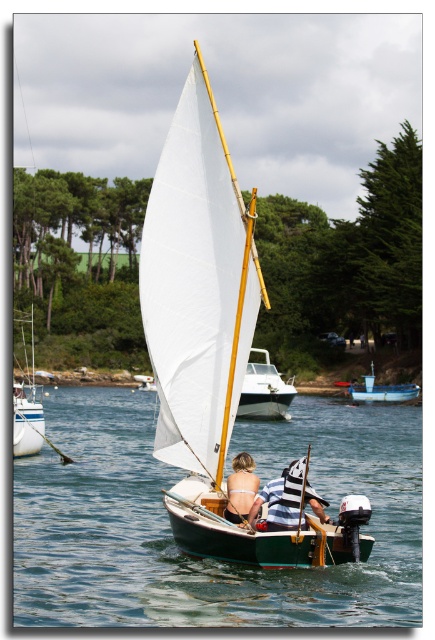
Is white plastic boat at left positioned behind blue plastic boat at center?

No, white plastic boat at left is in front of blue plastic boat at center.

Is white plastic boat at left closer to the viewer compared to blue plastic boat at center?

Yes, white plastic boat at left is closer to the viewer.

The width and height of the screenshot is (435, 640). I want to click on white plastic boat at left, so click(x=26, y=401).

Which is above, clear blue water at center or white glossy sailboat at center?

white glossy sailboat at center is above.

Between clear blue water at center and white glossy sailboat at center, which one has more height?

With more height is white glossy sailboat at center.

Locate an element on the screen. This screenshot has width=435, height=640. clear blue water at center is located at coordinates (208, 560).

Where is `clear blue water at center`? This screenshot has height=640, width=435. clear blue water at center is located at coordinates pos(208,560).

Is point (254, 417) positioned behind point (250, 461)?

Yes, it is.

Who is shorter, white glossy sailboat at center or matte white bikini top at center?

With less height is matte white bikini top at center.

Does point (271, 396) lie in front of point (228, 499)?

No, it is not.

You are a GUI agent. You are given a task and a screenshot of the screen. Output one action in this format:
    pyautogui.click(x=<x>, y=<y>)
    Task: Click on the white glossy sailboat at center
    Image resolution: width=435 pixels, height=640 pixels.
    Given the screenshot: What is the action you would take?
    pyautogui.click(x=264, y=390)